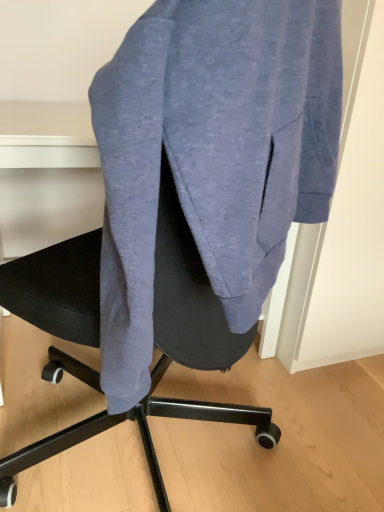
What is the approximate width of matte gray chair at center?

matte gray chair at center is 21.71 inches wide.

Where is `matte gray chair at center`? The image size is (384, 512). matte gray chair at center is located at coordinates (166, 353).

Measure the distance between point (264, 441) and camera.

The depth of point (264, 441) is 1.09 meters.

The width and height of the screenshot is (384, 512). What do you see at coordinates (166, 353) in the screenshot? I see `matte gray chair at center` at bounding box center [166, 353].

Image resolution: width=384 pixels, height=512 pixels. I want to click on matte gray chair at center, so click(x=166, y=353).